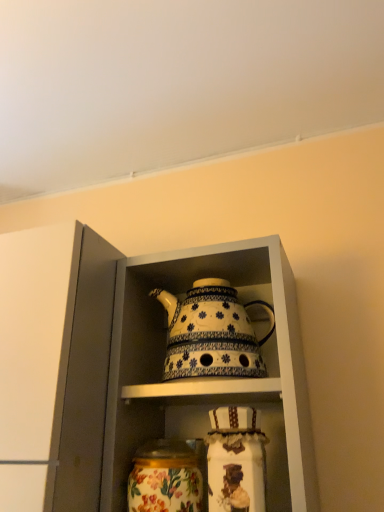
Question: Is white glossy teapot at center wider than floral painted glass jar at lower center?

Choices:
 (A) yes
 (B) no

Answer: (A)

Question: Could you tell me if white glossy teapot at center is facing floral painted glass jar at lower center?

Choices:
 (A) no
 (B) yes

Answer: (B)

Question: Does white glossy teapot at center appear on the right side of floral painted glass jar at lower center?

Choices:
 (A) yes
 (B) no

Answer: (A)

Question: Can you confirm if white glossy teapot at center is bigger than floral painted glass jar at lower center?

Choices:
 (A) no
 (B) yes

Answer: (B)

Question: Can you confirm if white glossy teapot at center is smaller than floral painted glass jar at lower center?

Choices:
 (A) no
 (B) yes

Answer: (A)

Question: Is white glossy teapot at center at the left side of floral painted glass jar at lower center?

Choices:
 (A) yes
 (B) no

Answer: (B)

Question: Is floral painted glass jar at lower center next to white glossy teapot at center?

Choices:
 (A) no
 (B) yes

Answer: (A)

Question: From the image's perspective, is floral painted glass jar at lower center located beneath white glossy teapot at center?

Choices:
 (A) no
 (B) yes

Answer: (B)

Question: Considering the relative sizes of floral painted glass jar at lower center and white glossy teapot at center in the image provided, is floral painted glass jar at lower center wider than white glossy teapot at center?

Choices:
 (A) yes
 (B) no

Answer: (B)

Question: Is floral painted glass jar at lower center outside white glossy teapot at center?

Choices:
 (A) no
 (B) yes

Answer: (A)

Question: Can you confirm if floral painted glass jar at lower center is smaller than white glossy teapot at center?

Choices:
 (A) yes
 (B) no

Answer: (A)

Question: Does floral painted glass jar at lower center appear on the right side of white glossy teapot at center?

Choices:
 (A) no
 (B) yes

Answer: (A)

Question: Is floral painted glass jar at lower center bigger than white ceramic teapot at center?

Choices:
 (A) yes
 (B) no

Answer: (B)